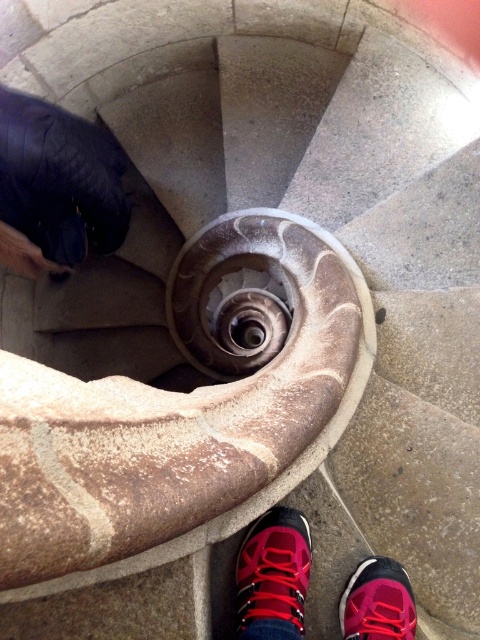
You are standing at the base of the spiral staircase and notice two shoes at your feet. Which shoe is closer to the top of the staircase, the red suede shoe at lower center or the pink fabric shoe at lower center?

The red suede shoe at lower center is closer to the top of the staircase because it is positioned above the pink fabric shoe at lower center.

You are standing at the base of the spiral staircase and notice two red shoes at the lower center of the scene. Which shoe is closer to the ground, the red fabric shoe at lower center or the red suede shoe at lower center?

The red fabric shoe at lower center is positioned under the red suede shoe at lower center, so the red fabric shoe at lower center is closer to the ground.